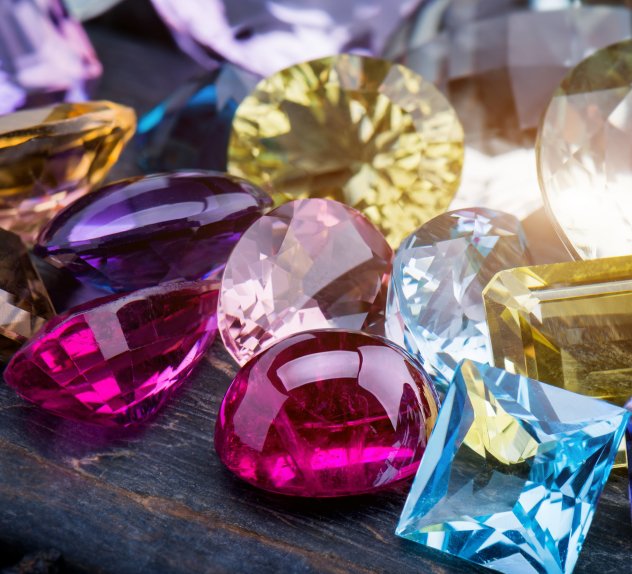
Image resolution: width=632 pixels, height=574 pixels. Identify the location of table. (67, 491).